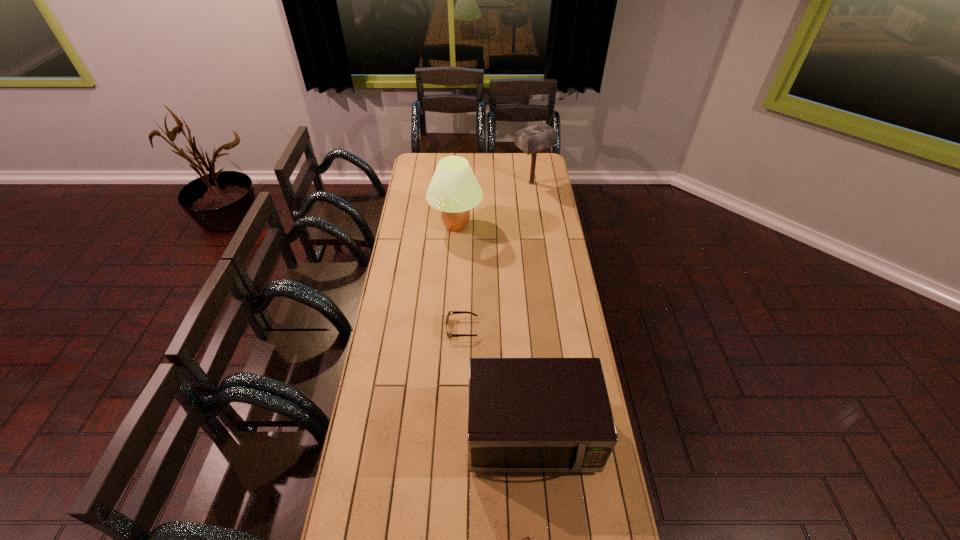
Find the location of a particular element. The height and width of the screenshot is (540, 960). object at the far edge is located at coordinates [532, 139].

Image resolution: width=960 pixels, height=540 pixels. Find the location of `object at the left edge`. object at the left edge is located at coordinates (454, 190).

I want to click on mallet that is at the right edge, so 532,139.

Find the location of `microwave oven that is at the right edge`. microwave oven that is at the right edge is located at coordinates (524, 414).

You are a GUI agent. You are given a task and a screenshot of the screen. Output one action in this format:
    pyautogui.click(x=<x>, y=<y>)
    Task: Click on the object that is positioned at the far right corner
    
    Given the screenshot: What is the action you would take?
    pyautogui.click(x=532, y=139)

The image size is (960, 540). I want to click on vacant region at the far edge, so (484, 170).

At what (x,y) coordinates should I click in order to perform the action: click on vacant position at the left edge of the desktop. Please return your answer as a coordinate pair (x, y). Looking at the image, I should click on (423, 181).

Where is `vacant space at the right edge of the desktop`? The image size is (960, 540). vacant space at the right edge of the desktop is located at coordinates (540, 176).

This screenshot has height=540, width=960. In order to click on free space between the mallet and the second nearest object in this screenshot , I will do `click(532, 309)`.

Where is `free space between the lampshade and the sunglasses`? free space between the lampshade and the sunglasses is located at coordinates (459, 277).